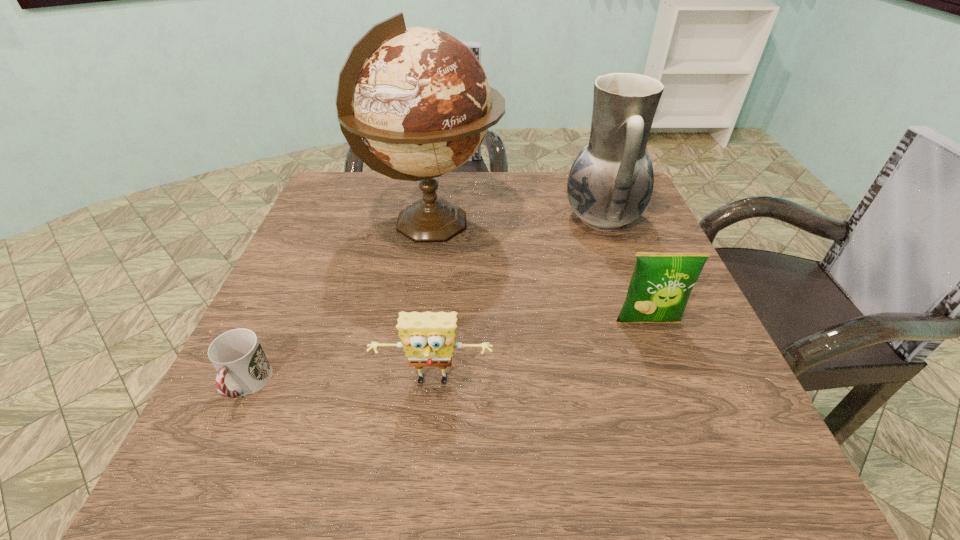
Locate an element on the screen. This screenshot has width=960, height=540. object that is positioned at the far left corner is located at coordinates (419, 98).

The height and width of the screenshot is (540, 960). I want to click on object that is at the far right corner, so click(610, 184).

In order to click on free space at the far edge of the desktop in this screenshot , I will do `click(389, 190)`.

The height and width of the screenshot is (540, 960). In order to click on vacant area at the near edge of the desktop in this screenshot , I will do `click(418, 471)`.

Identify the location of free space at the left edge. The image size is (960, 540). (286, 315).

This screenshot has width=960, height=540. What are the coordinates of `free space at the right edge` in the screenshot? It's located at (643, 330).

The image size is (960, 540). What are the coordinates of `vacant space at the near left corner of the desktop` in the screenshot? It's located at click(283, 449).

At what (x,y) coordinates should I click in order to perform the action: click on vacant space at the near right corner of the desktop. Please return your answer as a coordinate pair (x, y). Looking at the image, I should click on (700, 482).

In order to click on empty location between the pitcher and the sponge in this screenshot , I will do (517, 300).

Identify the location of free spot between the leftmost object and the globe. The image size is (960, 540). (340, 305).